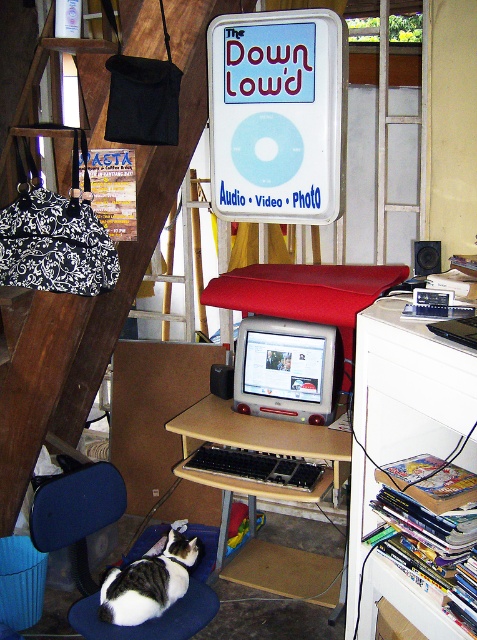
Looking at this image, you are organizing a photo shoot in this workspace and need to position a small camera tripod. The tripod requires a flat surface that is higher than the black and white fur cat at lower left but lower than the black plastic keyboard at center. Is there a suitable surface available on the desk?

Result: The black and white fur cat at lower left is below the black plastic keyboard at center, so the area between them might have a flat surface that is higher than the cat but lower than the keyboard. However, since the keyboard is at center and the cat is at lower left, the desk surface between them could potentially accommodate the tripod if there is enough space not occupied by other items.

You are organizing your desk and want to place a new keyboard. The keyboard is 40 cm wide. The black plastic computer desk at center has a space between the matte silver monitor at center and the edge of the desk. Is there enough space for the keyboard?

The matte silver monitor at center is positioned on the right side of black plastic computer desk at center. Since the monitor is on the right, the space to the left of it might be sufficient for the keyboard. However, without knowing the exact dimensions of the desk and the distance from the monitor to the edge, it is impossible to confirm if the 40 cm keyboard will fit. Please measure the available space.